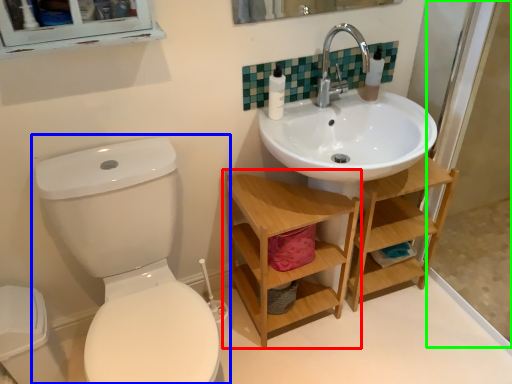
Question: Estimate the real-world distances between objects in this image. Which object is closer to shelf (highlighted by a red box), toilet (highlighted by a blue box) or screen door (highlighted by a green box)?

Choices:
 (A) toilet
 (B) screen door

Answer: (A)